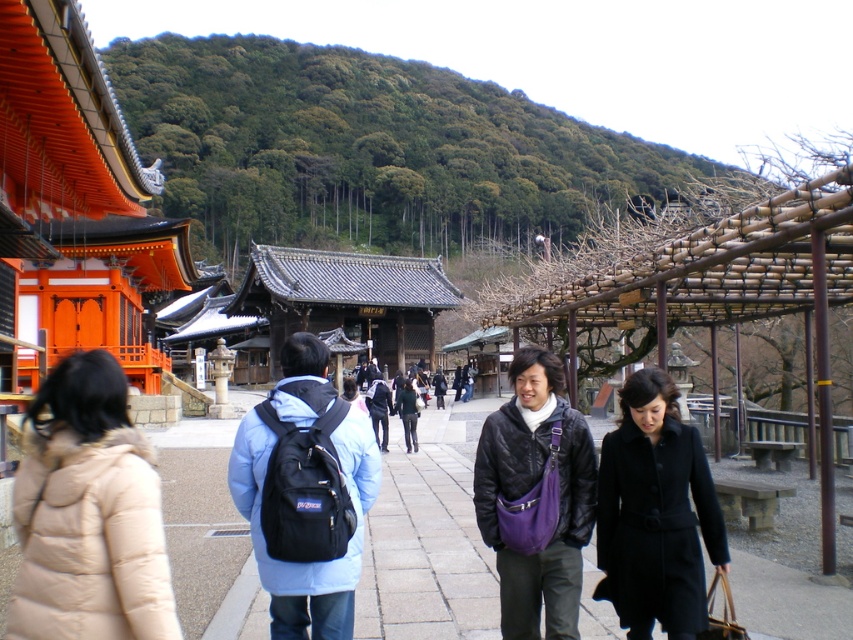
You are standing at the entrance of the temple complex and see two points marked in the image. The first point is at coordinate point [26,602] and the second is at coordinate point [695,499]. Which point is closer to you?

Point [26,602] is in front of point [695,499], so it is closer to you.

You are standing at the entrance of the temple complex and want to reach the main building. The paved stone walkway at center is the path you need to take. Given that you can walk 1.5 meters per second, how many seconds will it take you to reach the main building?

The distance between the viewer and the paved stone walkway at center is 7.41 meters. Since you can walk 1.5 meters per second, it will take approximately 4.94 seconds to reach the main building.

You are standing at the entrance of the temple complex and want to reach the main building. According to the image, where should you walk to find the paved stone walkway at center?

The paved stone walkway at center is located at point (428,538), so you should walk towards that coordinate to reach the main building.